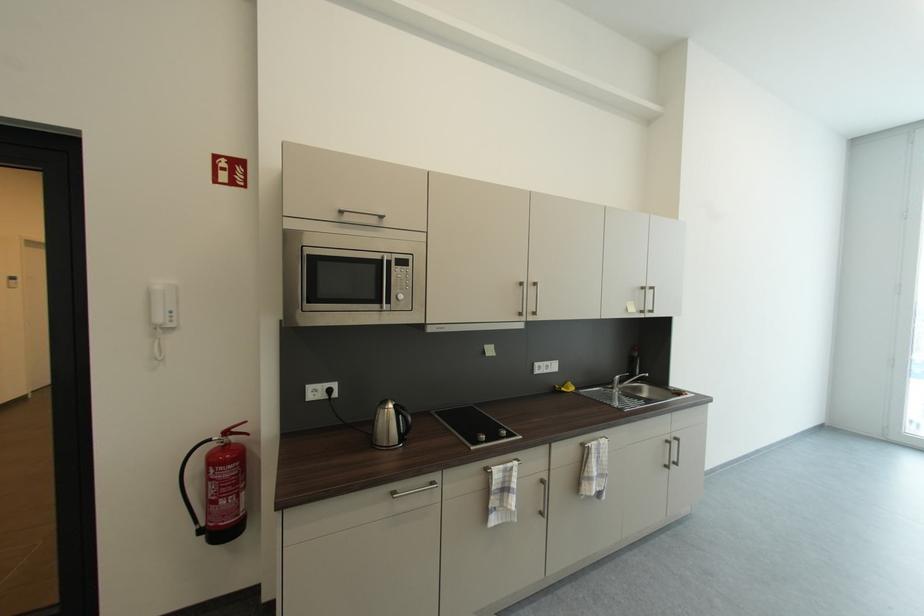
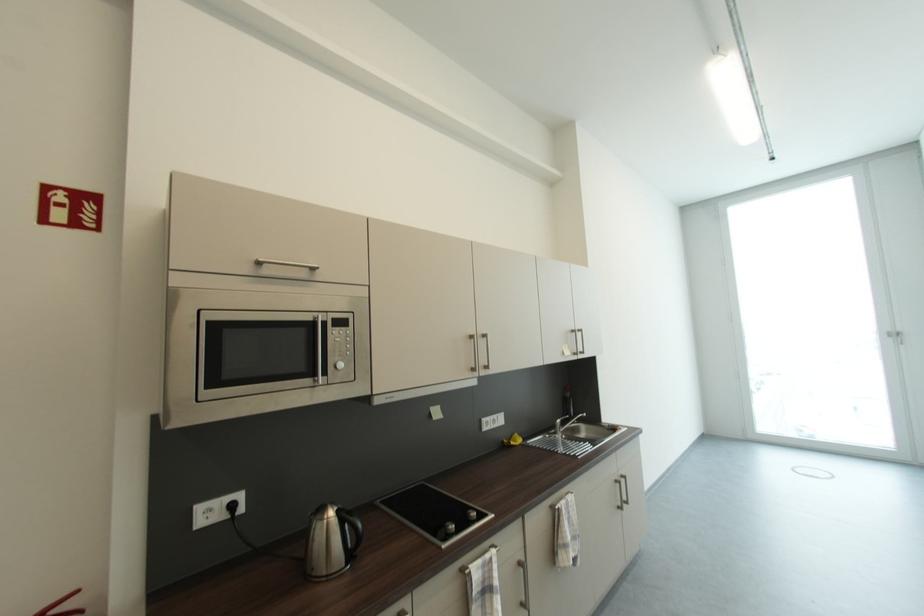
Question: The camera is either moving clockwise (left) or counter-clockwise (right) around the object. The first image is from the beginning of the video and the second image is from the end. Is the camera moving left or right when shooting the video?

Choices:
 (A) Left
 (B) Right

Answer: (A)